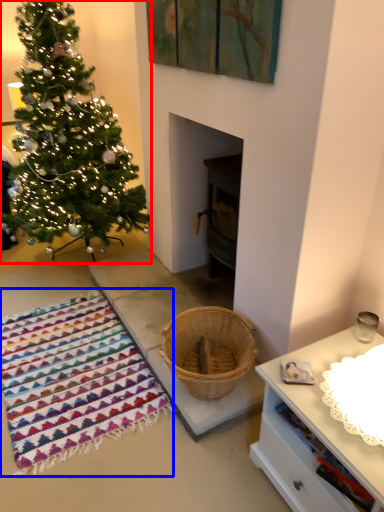
Question: Which object appears farthest to the camera in this image, christmas tree (highlighted by a red box) or blanket (highlighted by a blue box)?

Choices:
 (A) christmas tree
 (B) blanket

Answer: (A)